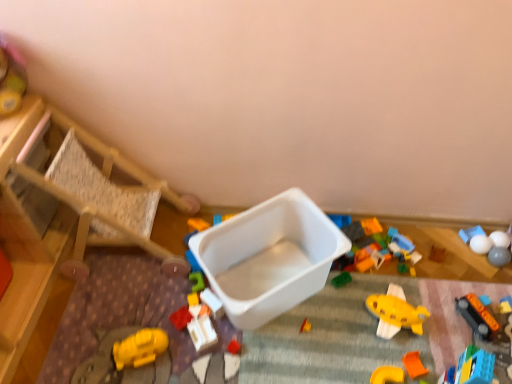
The image size is (512, 384). What do you see at coordinates (371, 226) in the screenshot?
I see `rubberized plastic blocks at center, which is the 9th toy in right-to-left order` at bounding box center [371, 226].

What is the approximate width of white matte ball at upper right, the third toy when ordered from right to left?

white matte ball at upper right, the third toy when ordered from right to left, is 7.76 centimeters in width.

The height and width of the screenshot is (384, 512). What are the coordinates of `smooth plastic container at upper left, which ranks as the 1th toy in left-to-right order` in the screenshot? It's located at (11, 80).

What do you see at coordinates (11, 80) in the screenshot? The height and width of the screenshot is (384, 512). I see `smooth plastic container at upper left, positioned as the fourteenth toy in right-to-left order` at bounding box center [11, 80].

Find the location of a particular element. Image resolution: width=512 pixels, height=384 pixels. orange matte block at lower right, arranged as the eighth toy when viewed from the left is located at coordinates (414, 365).

What do you see at coordinates (437, 254) in the screenshot? This screenshot has height=384, width=512. I see `brown matte toy at center, placed as the sixth toy when sorted from right to left` at bounding box center [437, 254].

The width and height of the screenshot is (512, 384). What are the coordinates of `smooth gray ball at lower right, the thirteenth toy when ordered from left to right` in the screenshot? It's located at (499, 256).

Consider the image. Measure the distance between point (480, 244) and camera.

The distance of point (480, 244) from camera is 1.57 meters.

In order to click on rubberized plastic blocks at center, which is counted as the sixth toy, starting from the left in this screenshot , I will do `click(371, 226)`.

Is orange matte plastic toy at lower right, which is counted as the 5th toy, starting from the left, thinner than rubberized plastic toy at center, the thirteenth toy positioned from the right?

Indeed, orange matte plastic toy at lower right, which is counted as the 5th toy, starting from the left, has a lesser width compared to rubberized plastic toy at center, the thirteenth toy positioned from the right.

Can you confirm if orange matte plastic toy at lower right, which is counted as the 5th toy, starting from the left, is bigger than rubberized plastic toy at center, which ranks as the 2th toy in left-to-right order?

Yes, orange matte plastic toy at lower right, which is counted as the 5th toy, starting from the left, is bigger than rubberized plastic toy at center, which ranks as the 2th toy in left-to-right order.

Which object is closer to the camera taking this photo, orange matte plastic toy at lower right, the 10th toy viewed from the right, or rubberized plastic toy at center, which ranks as the 2th toy in left-to-right order?

orange matte plastic toy at lower right, the 10th toy viewed from the right, is more forward.

Is point (403, 373) closer or farther from the camera than point (184, 315)?

Clearly, point (403, 373) is closer to the camera than point (184, 315).

At what (x,y) coordinates should I click in order to perform the action: click on storage box that appears on the left of white glossy ball at upper right, the 11th toy in the left-to-right sequence. Please return your answer as a coordinate pair (x, y). The image size is (512, 384). Looking at the image, I should click on (269, 257).

How different are the orientations of white glossy ball at upper right, the fourth toy positioned from the right, and white plastic container at center in degrees?

34.1 degrees.

Is white glossy ball at upper right, the 11th toy in the left-to-right sequence, in front of or behind white plastic container at center in the image?

→ Visually, white glossy ball at upper right, the 11th toy in the left-to-right sequence, is located behind white plastic container at center.

Is white glossy ball at upper right, the fourth toy positioned from the right, smaller than white plastic container at center?

Correct, white glossy ball at upper right, the fourth toy positioned from the right, occupies less space than white plastic container at center.

Between point (345, 218) and point (417, 375), which one is positioned in front?

Point (417, 375)

From the picture: Is the depth of blue plastic toy at center, the 11th toy in the right-to-left sequence, greater than that of orange matte block at lower right, placed as the seventh toy when sorted from right to left?

Yes, blue plastic toy at center, the 11th toy in the right-to-left sequence, is behind orange matte block at lower right, placed as the seventh toy when sorted from right to left.

Can you confirm if blue plastic toy at center, the fourth toy from the left, is taller than orange matte block at lower right, placed as the seventh toy when sorted from right to left?

Yes.

Consider the image. Is white plastic container at center touching smooth gray ball at lower right, the thirteenth toy when ordered from left to right?

No, white plastic container at center is not beside smooth gray ball at lower right, the thirteenth toy when ordered from left to right.

Is smooth gray ball at lower right, which appears as the 2th toy when viewed from the right, at the back of white plastic container at center?

No, white plastic container at center's orientation is not away from smooth gray ball at lower right, which appears as the 2th toy when viewed from the right.

From the image's perspective, between white plastic container at center and smooth gray ball at lower right, the thirteenth toy when ordered from left to right, who is located below?

white plastic container at center, from the image's perspective.

Is point (76, 239) less distant than point (472, 244)?

That is True.

Can you confirm if wooden chair at left is smaller than white glossy ball at upper right, the 11th toy in the left-to-right sequence?

Incorrect, wooden chair at left is not smaller in size than white glossy ball at upper right, the 11th toy in the left-to-right sequence.

From a real-world perspective, is wooden chair at left positioned above or below white glossy ball at upper right, the fourth toy positioned from the right?

In terms of real-world spatial position, wooden chair at left is above white glossy ball at upper right, the fourth toy positioned from the right.

Consider the image. Is wooden chair at left oriented away from white glossy ball at upper right, the 11th toy in the left-to-right sequence?

That's not correct — wooden chair at left is not looking away from white glossy ball at upper right, the 11th toy in the left-to-right sequence.

Does white plastic container at center, which is counted as the 12th toy, starting from the right, have a lesser width compared to white glossy ball at upper right, the fourth toy positioned from the right?

Incorrect, the width of white plastic container at center, which is counted as the 12th toy, starting from the right, is not less than that of white glossy ball at upper right, the fourth toy positioned from the right.

Starting from the white glossy ball at upper right, the fourth toy positioned from the right, which toy is the 3rd one in front? Please provide its 2D coordinates.

[(202, 332)]

From the picture: What's the angular difference between white plastic container at center, the third toy viewed from the left, and white glossy ball at upper right, the 11th toy in the left-to-right sequence,'s facing directions?

34.1 degrees.

Which object is wider, orange matte plastic toy at lower right, which is counted as the 5th toy, starting from the left, or white matte ball at upper right, which is the twelfth toy from left to right?

white matte ball at upper right, which is the twelfth toy from left to right.

From the image's perspective, is orange matte plastic toy at lower right, the 10th toy viewed from the right, below white matte ball at upper right, the third toy when ordered from right to left?

Correct, orange matte plastic toy at lower right, the 10th toy viewed from the right, appears lower than white matte ball at upper right, the third toy when ordered from right to left, in the image.

Considering the sizes of objects orange matte plastic toy at lower right, the 10th toy viewed from the right, and white matte ball at upper right, which is the twelfth toy from left to right, in the image provided, who is bigger, orange matte plastic toy at lower right, the 10th toy viewed from the right, or white matte ball at upper right, which is the twelfth toy from left to right,?

With larger size is white matte ball at upper right, which is the twelfth toy from left to right.

I want to click on the 3rd toy below when counting from the rubberized plastic toy at center, the thirteenth toy positioned from the right (from the image's perspective), so click(x=387, y=375).

This screenshot has width=512, height=384. I want to click on the 3rd toy above the white plastic container at center (from the image's perspective), so click(480, 244).

Looking at this image, considering their positions, is wooden chair at left positioned closer to orange matte plastic toy at lower right, the 10th toy viewed from the right, than orange matte block at lower right, arranged as the eighth toy when viewed from the left?

orange matte block at lower right, arranged as the eighth toy when viewed from the left, is positioned closer to the anchor orange matte plastic toy at lower right, the 10th toy viewed from the right.

Based on the photo, from the image, which object appears to be farther from white matte ball at upper right, which is the twelfth toy from left to right, rubberized plastic toy at center, which ranks as the 2th toy in left-to-right order, or white plastic container at center?

rubberized plastic toy at center, which ranks as the 2th toy in left-to-right order, is further to white matte ball at upper right, which is the twelfth toy from left to right.

When comparing their distances from white matte balls at upper right, arranged as the 14th toy when viewed from the left, does smooth plastic container at upper left, positioned as the fourteenth toy in right-to-left order, or white glossy ball at upper right, the 11th toy in the left-to-right sequence, seem further?

smooth plastic container at upper left, positioned as the fourteenth toy in right-to-left order.

Estimate the real-world distances between objects in this image. Which object is closer to smooth gray ball at lower right, the thirteenth toy when ordered from left to right, rubberized plastic blocks at center, which is the 9th toy in right-to-left order, or brown matte toy at center, placed as the sixth toy when sorted from right to left?

Among the two, brown matte toy at center, placed as the sixth toy when sorted from right to left, is located nearer to smooth gray ball at lower right, the thirteenth toy when ordered from left to right.

Which object lies further to the anchor point white plastic container at center, white glossy ball at upper right, the fourth toy positioned from the right, or white matte balls at upper right, arranged as the 14th toy when viewed from the left?

Based on the image, white matte balls at upper right, arranged as the 14th toy when viewed from the left, appears to be further to white plastic container at center.

Looking at the image, which one is located closer to smooth gray ball at lower right, which appears as the 2th toy when viewed from the right, orange matte plastic toy at lower right, the 10th toy viewed from the right, or blue plastic toy at center, the 11th toy in the right-to-left sequence?

blue plastic toy at center, the 11th toy in the right-to-left sequence, lies closer to smooth gray ball at lower right, which appears as the 2th toy when viewed from the right, than the other object.

From the image, which object appears to be farther from smooth plastic container at upper left, which ranks as the 1th toy in left-to-right order, smooth gray ball at lower right, which appears as the 2th toy when viewed from the right, or white matte ball at upper right, which is the twelfth toy from left to right?

The object further to smooth plastic container at upper left, which ranks as the 1th toy in left-to-right order, is smooth gray ball at lower right, which appears as the 2th toy when viewed from the right.

Looking at this image, based on their spatial positions, is white matte ball at upper right, the third toy when ordered from right to left, or orange plastic train at lower right, the tenth toy in the left-to-right sequence, closer to white plastic container at center?

orange plastic train at lower right, the tenth toy in the left-to-right sequence, is closer to white plastic container at center.

Locate an element on the screen. The width and height of the screenshot is (512, 384). storage box located between white plastic container at center, the third toy viewed from the left, and blue plastic toy at center, the fourth toy from the left, in the left-right direction is located at coordinates (269, 257).

This screenshot has height=384, width=512. In order to click on storage box between wooden chair at left and orange plastic train at lower right, which is the 5th toy in right-to-left order in this screenshot , I will do `click(269, 257)`.

You are a GUI agent. You are given a task and a screenshot of the screen. Output one action in this format:
    pyautogui.click(x=<x>, y=<y>)
    Task: Click on the furniture located between smooth plastic container at upper left, which ranks as the 1th toy in left-to-right order, and white glossy ball at upper right, the 11th toy in the left-to-right sequence, in the left-right direction
    The image size is (512, 384).
    Given the screenshot: What is the action you would take?
    pyautogui.click(x=41, y=242)

Where is `storage box located between wooden chair at left and blue plastic toy at center, the 11th toy in the right-to-left sequence, in the left-right direction`? The width and height of the screenshot is (512, 384). storage box located between wooden chair at left and blue plastic toy at center, the 11th toy in the right-to-left sequence, in the left-right direction is located at coordinates (269, 257).